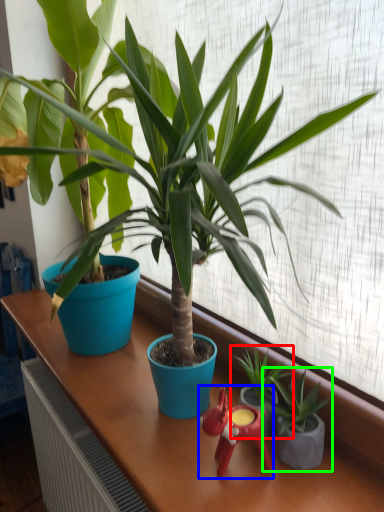
Question: Which is nearer to the houseplant (highlighted by a red box)? miniature (highlighted by a blue box) or houseplant (highlighted by a green box).

Choices:
 (A) miniature
 (B) houseplant

Answer: (B)